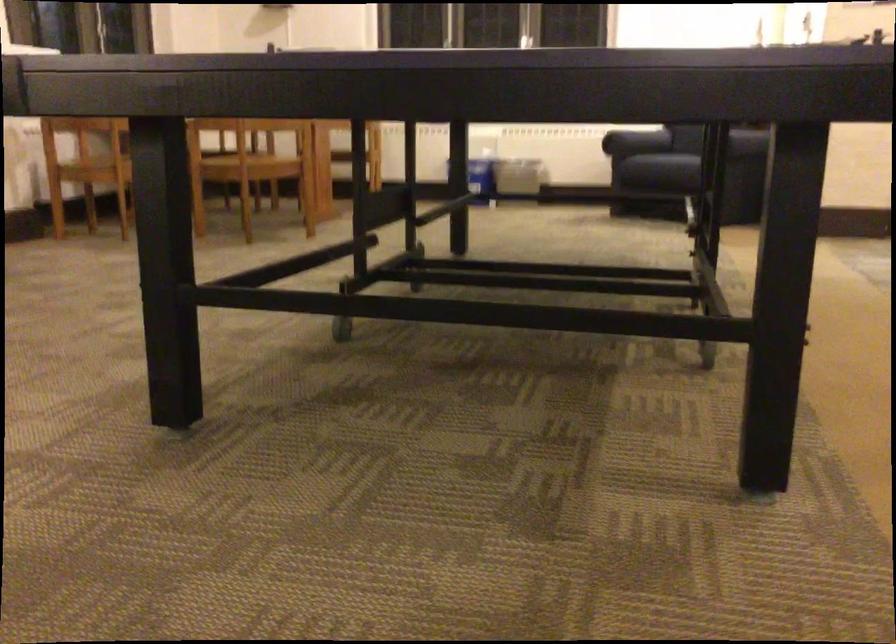
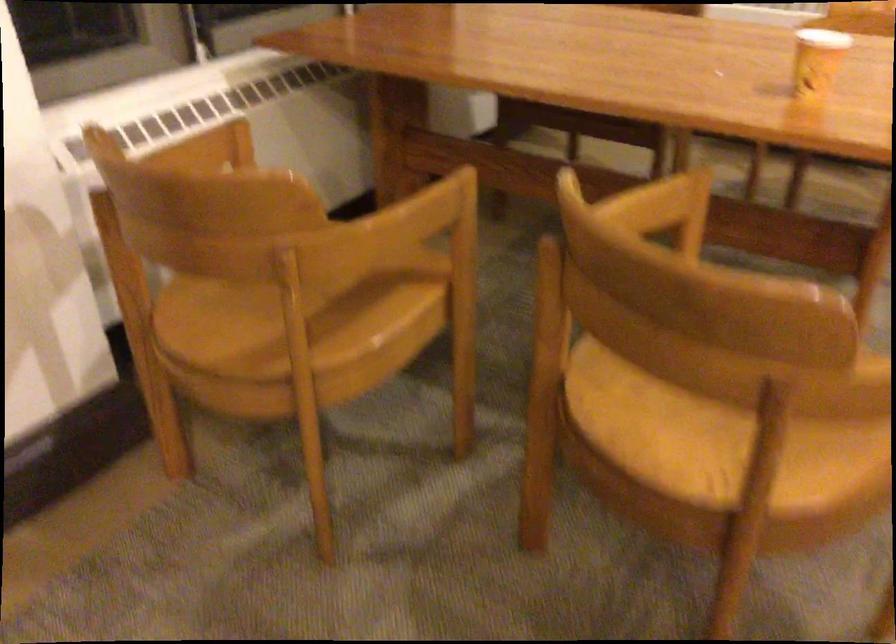
The point at (236, 174) is marked in the first image. Where is the corresponding point in the second image?

(704, 433)